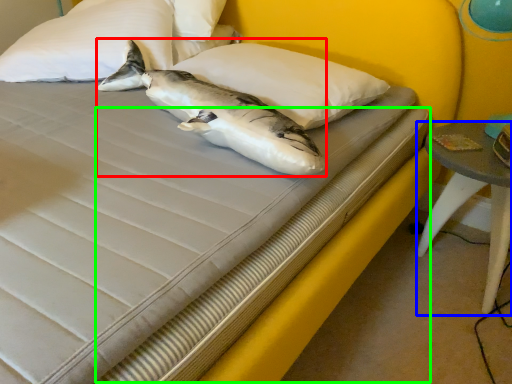
Question: Estimate the real-world distances between objects in this image. Which object is closer to shark (highlighted by a red box), table (highlighted by a blue box) or bed frame (highlighted by a green box)?

Choices:
 (A) table
 (B) bed frame

Answer: (B)